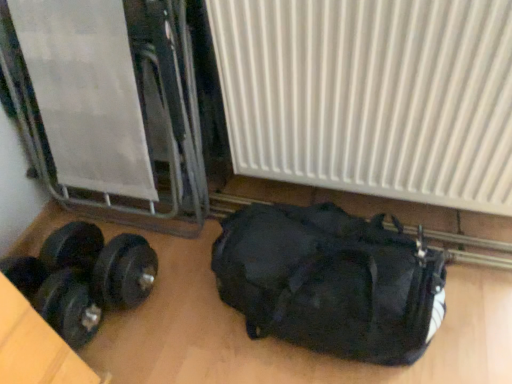
This screenshot has width=512, height=384. What do you see at coordinates (371, 96) in the screenshot?
I see `white ribbed radiator at center` at bounding box center [371, 96].

Measure the distance between black matte duffel bag at lower right and camera.

black matte duffel bag at lower right is 34.77 inches from camera.

Identify the location of black matte duffel bag at lower right. (330, 282).

Image resolution: width=512 pixels, height=384 pixels. I want to click on white ribbed radiator at center, so click(x=371, y=96).

In terms of size, does white ribbed radiator at center appear bigger or smaller than black matte duffel bag at lower right?

Clearly, white ribbed radiator at center is larger in size than black matte duffel bag at lower right.

Is white ribbed radiator at center positioned beyond the bounds of black matte duffel bag at lower right?

white ribbed radiator at center is positioned outside black matte duffel bag at lower right.

Is white ribbed radiator at center next to black matte duffel bag at lower right?

No, white ribbed radiator at center is not in contact with black matte duffel bag at lower right.

Is white ribbed radiator at center oriented away from black matte duffel bag at lower right?

white ribbed radiator at center does not have its back to black matte duffel bag at lower right.

From the image's perspective, is black matte duffel bag at lower right over black rubber dumbbell at lower left?

Yes, from the image's perspective, black matte duffel bag at lower right is above black rubber dumbbell at lower left.

The width and height of the screenshot is (512, 384). In the image, there is a black matte duffel bag at lower right. In order to click on dumbbell below it (from the image's perspective) in this screenshot , I will do `click(83, 278)`.

Consider the image. From a real-world perspective, is black matte duffel bag at lower right positioned under black rubber dumbbell at lower left based on gravity?

No, from a real-world perspective, black matte duffel bag at lower right is not below black rubber dumbbell at lower left.

From the image's perspective, is black matte duffel bag at lower right under white ribbed radiator at center?

Correct, black matte duffel bag at lower right appears lower than white ribbed radiator at center in the image.

Is black matte duffel bag at lower right situated inside white ribbed radiator at center or outside?

black matte duffel bag at lower right cannot be found inside white ribbed radiator at center.

From the picture: In the image, is white ribbed radiator at center positioned in front of or behind black rubber dumbbell at lower left?

Visually, white ribbed radiator at center is located in front of black rubber dumbbell at lower left.

From the image's perspective, is white ribbed radiator at center above or below black rubber dumbbell at lower left?

white ribbed radiator at center is above black rubber dumbbell at lower left.

Is point (274, 104) less distant than point (47, 266)?

Yes, point (274, 104) is in front of point (47, 266).

Is white ribbed radiator at center smaller than black rubber dumbbell at lower left?

No, white ribbed radiator at center is not smaller than black rubber dumbbell at lower left.

Based on the photo, from the image's perspective, is black rubber dumbbell at lower left above or below white ribbed radiator at center?

Based on their image positions, black rubber dumbbell at lower left is located beneath white ribbed radiator at center.

From a real-world perspective, is black rubber dumbbell at lower left positioned under white ribbed radiator at center based on gravity?

Correct, in the physical world, black rubber dumbbell at lower left is lower than white ribbed radiator at center.

From the picture: Which object is positioned more to the right, black rubber dumbbell at lower left or white ribbed radiator at center?

From the viewer's perspective, white ribbed radiator at center appears more on the right side.

In terms of height, does black rubber dumbbell at lower left look taller or shorter compared to black matte duffel bag at lower right?

black rubber dumbbell at lower left is shorter than black matte duffel bag at lower right.

You are a GUI agent. You are given a task and a screenshot of the screen. Output one action in this format:
    pyautogui.click(x=<x>, y=<y>)
    Task: Click on the dumbbell directly beneath the black matte duffel bag at lower right (from a real-world perspective)
    The image size is (512, 384).
    Given the screenshot: What is the action you would take?
    pyautogui.click(x=83, y=278)

Is black matte duffel bag at lower right surrounded by black rubber dumbbell at lower left?

No, black matte duffel bag at lower right is not surrounded by black rubber dumbbell at lower left.

Which of these two, black rubber dumbbell at lower left or black matte duffel bag at lower right, is thinner?

Thinner between the two is black rubber dumbbell at lower left.

This screenshot has width=512, height=384. I want to click on radiator to the right of black matte duffel bag at lower right, so click(x=371, y=96).

Locate an element on the screen. This screenshot has height=384, width=512. dumbbell located on the left of black matte duffel bag at lower right is located at coordinates (83, 278).

Estimate the real-world distances between objects in this image. Which object is closer to black matte duffel bag at lower right, black rubber dumbbell at lower left or white ribbed radiator at center?

white ribbed radiator at center is positioned closer to the anchor black matte duffel bag at lower right.

Considering their positions, is white ribbed radiator at center positioned further to black rubber dumbbell at lower left than black matte duffel bag at lower right?

white ribbed radiator at center is positioned further to the anchor black rubber dumbbell at lower left.

Considering their positions, is black matte duffel bag at lower right positioned closer to black rubber dumbbell at lower left than white ribbed radiator at center?

black matte duffel bag at lower right is closer to black rubber dumbbell at lower left.

Consider the image. Which object lies further to the anchor point white ribbed radiator at center, black matte duffel bag at lower right or black rubber dumbbell at lower left?

black rubber dumbbell at lower left is further to white ribbed radiator at center.

Considering their positions, is black rubber dumbbell at lower left positioned further to white ribbed radiator at center than black matte duffel bag at lower right?

The object further to white ribbed radiator at center is black rubber dumbbell at lower left.

From the image, which object appears to be nearer to black matte duffel bag at lower right, white ribbed radiator at center or black rubber dumbbell at lower left?

Among the two, white ribbed radiator at center is located nearer to black matte duffel bag at lower right.

I want to click on luggage and bags between black rubber dumbbell at lower left and white ribbed radiator at center from left to right, so click(330, 282).